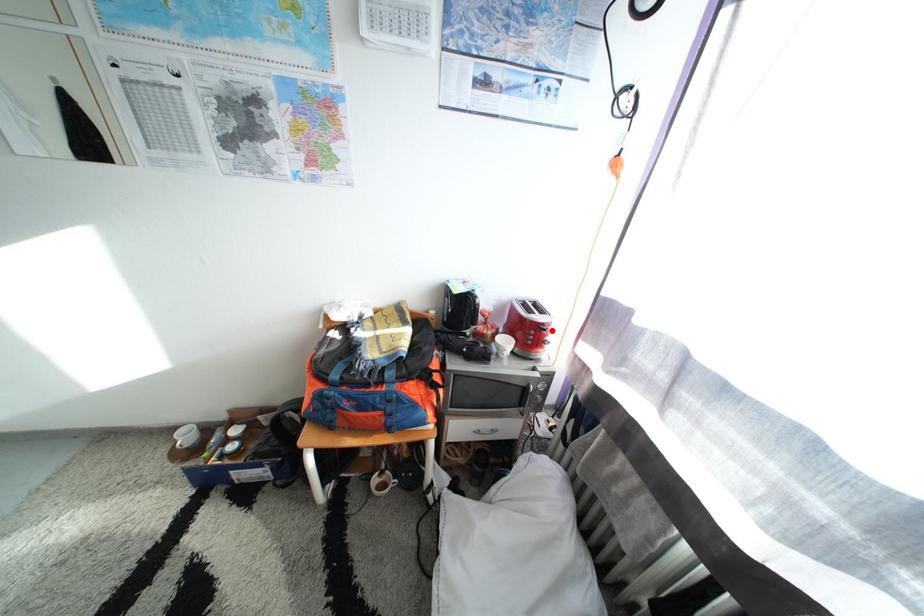
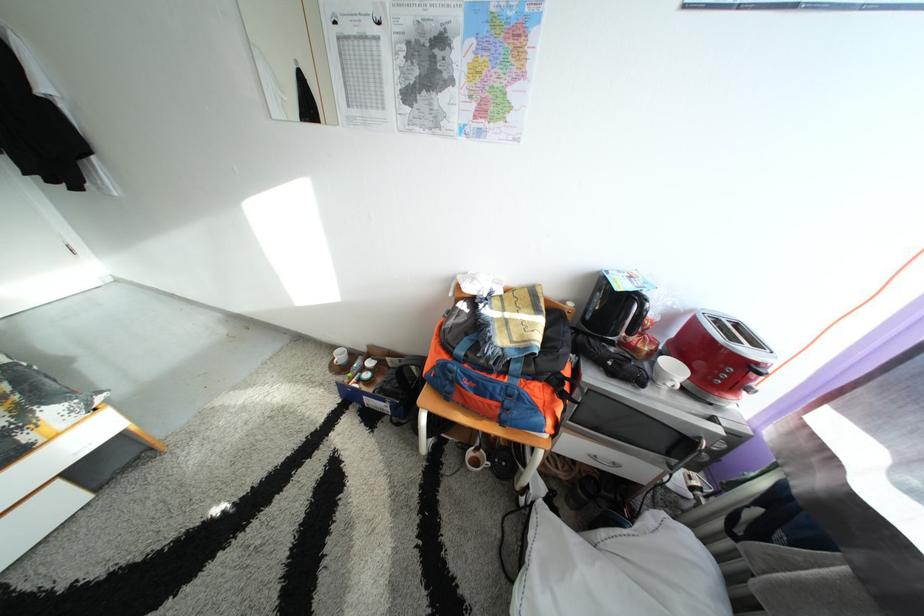
The point at the highlighted location is marked in the first image. Where is the corresponding point in the second image?

(767, 370)